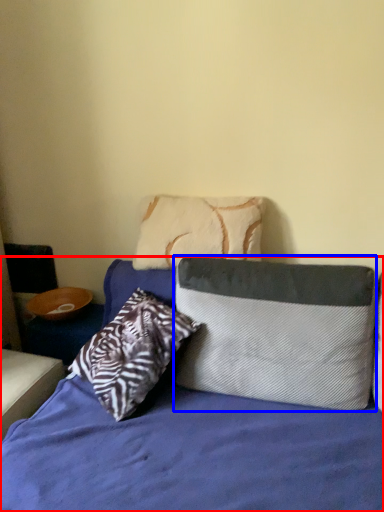
Question: Which point is closer to the camera, bed (highlighted by a red box) or pillow (highlighted by a blue box)?

Choices:
 (A) bed
 (B) pillow

Answer: (A)